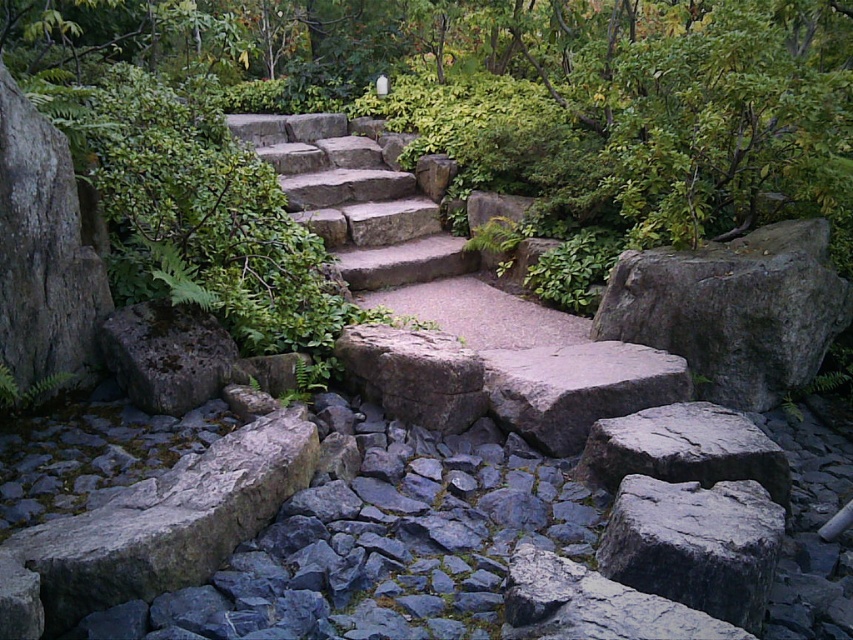
Question: Is the position of gray rough rock at center-right less distant than that of gray rough rock at lower right?

Choices:
 (A) yes
 (B) no

Answer: (B)

Question: Which object appears farthest from the camera in this image?

Choices:
 (A) gray rough rock at lower right
 (B) gray rough rock at center-right

Answer: (B)

Question: Which point is farther from the camera taking this photo?

Choices:
 (A) (805, 276)
 (B) (637, 349)
 (C) (642, 528)

Answer: (B)

Question: Where is natural stone stairs at center located in relation to gray rough rock at center-right in the image?

Choices:
 (A) right
 (B) left

Answer: (B)

Question: Which object appears farthest from the camera in this image?

Choices:
 (A) gray rough rock at lower right
 (B) gray rough rock at center-right
 (C) natural stone stairs at center

Answer: (B)

Question: Can you confirm if natural stone stairs at center is positioned to the left of gray rough rock at lower right?

Choices:
 (A) no
 (B) yes

Answer: (B)